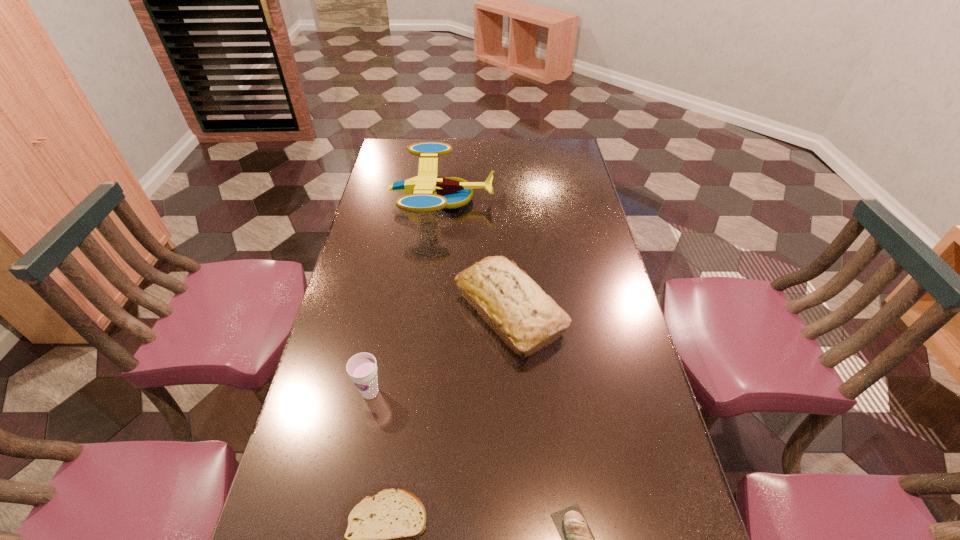
Where is `vacant space at the right edge`? vacant space at the right edge is located at coordinates 670,539.

The image size is (960, 540). Identify the location of free space at the far right corner. tap(563, 140).

Where is `free area in between the third nearest object and the bread`? free area in between the third nearest object and the bread is located at coordinates (440, 352).

At what (x,y) coordinates should I click in order to perform the action: click on empty location between the cup and the bread. Please return your answer as a coordinate pair (x, y). Looking at the image, I should click on (440, 352).

Locate which object ranks in proximity to the cup. Please provide its 2D coordinates. Your answer should be formatted as a tuple, i.e. [(x, y)], where the tuple contains the x and y coordinates of a point satisfying the conditions above.

[(527, 319)]

Where is `object identified as the fourth closest to the third farthest object`? Image resolution: width=960 pixels, height=540 pixels. object identified as the fourth closest to the third farthest object is located at coordinates (428, 192).

Find the location of a particular element. This screenshot has height=540, width=960. vacant space that satisfies the following two spatial constraints: 1. at the cockpit of the drone; 2. on the right side of the bread is located at coordinates (430, 311).

Locate an element on the screen. This screenshot has height=540, width=960. blank area in the image that satisfies the following two spatial constraints: 1. at the cockpit of the farthest object; 2. on the left side of the fourth nearest object is located at coordinates (430, 311).

The width and height of the screenshot is (960, 540). I want to click on vacant space that satisfies the following two spatial constraints: 1. on the back side of the bread; 2. on the right side of the cup, so click(x=386, y=311).

This screenshot has width=960, height=540. I want to click on vacant space that satisfies the following two spatial constraints: 1. on the back side of the fourth nearest object; 2. at the cockpit of the drone, so click(x=502, y=200).